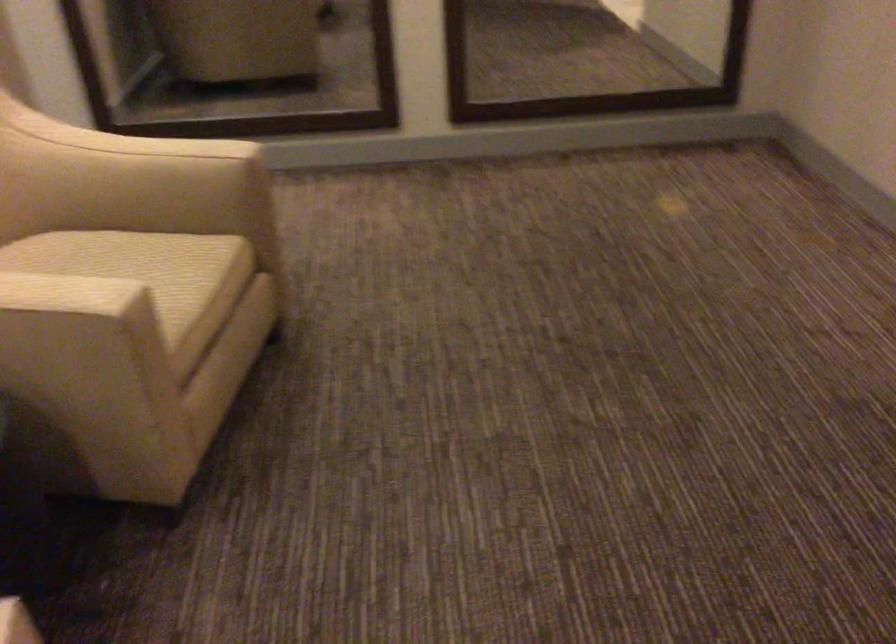
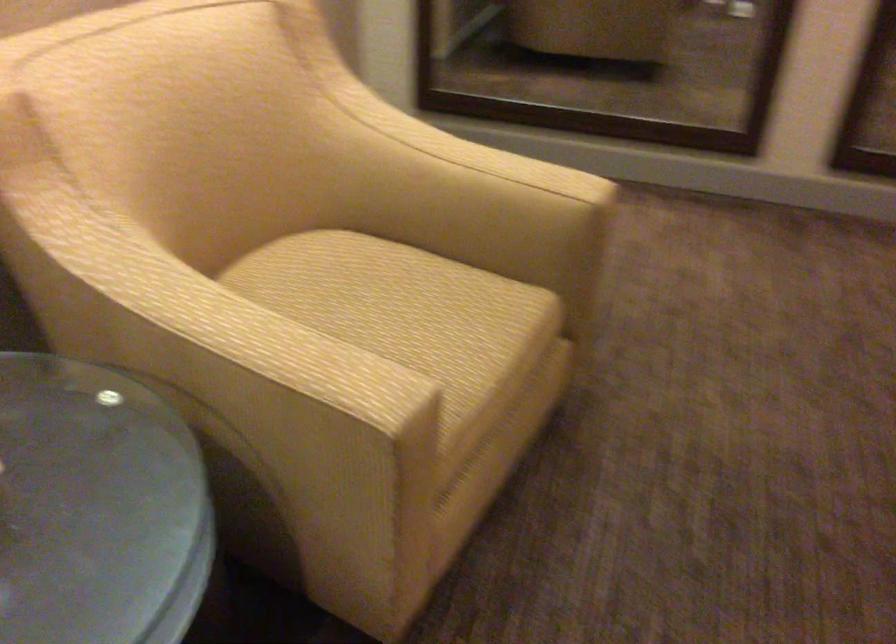
Find the pixel in the second image that matches point 119,270 in the first image.

(403, 310)